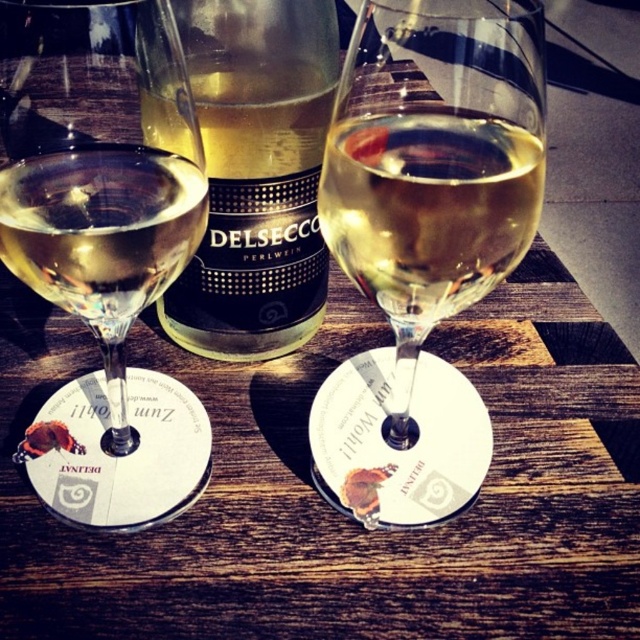
Between translucent glass wine glass at center and clear glass wine glass at left, which one is positioned lower?

clear glass wine glass at left is lower down.

Locate an element on the screen. translucent glass wine glass at center is located at coordinates (424, 240).

The width and height of the screenshot is (640, 640). Describe the element at coordinates (424, 240) in the screenshot. I see `translucent glass wine glass at center` at that location.

Locate an element on the screen. This screenshot has height=640, width=640. translucent glass wine glass at center is located at coordinates (x=424, y=240).

Is translucent glass bottle at center taller than translucent glass wine at center?

Yes, translucent glass bottle at center is taller than translucent glass wine at center.

Does point (282, 253) lie behind point (324, 221)?

Yes, point (282, 253) is behind point (324, 221).

Where is `translucent glass bottle at center`? This screenshot has width=640, height=640. translucent glass bottle at center is located at coordinates (257, 173).

Describe the element at coordinates (104, 246) in the screenshot. I see `clear glass wine glass at left` at that location.

Does point (116, 148) come farther from viewer compared to point (140, 99)?

No, it is not.

Who is more distant from viewer, (176, 52) or (240, 163)?

The point (240, 163) is more distant.

I want to click on clear glass wine glass at left, so click(x=104, y=246).